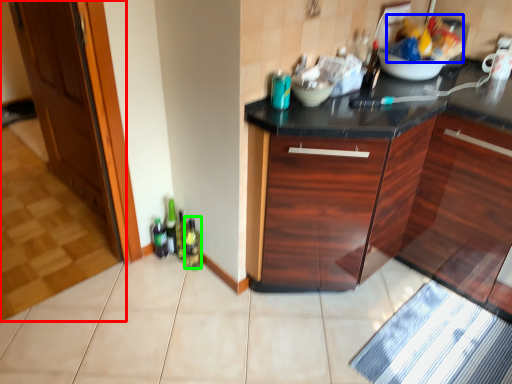
Question: Which object is the closest to the door (highlighted by a red box)? Choose among these: food (highlighted by a blue box) or bottle (highlighted by a green box).

Choices:
 (A) food
 (B) bottle

Answer: (B)